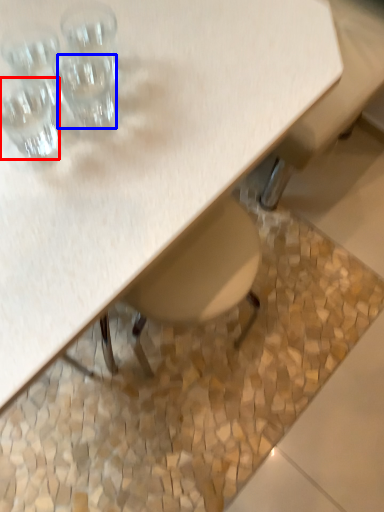
Question: Which object appears closest to the camera in this image, shot glass (highlighted by a red box) or shot glass (highlighted by a blue box)?

Choices:
 (A) shot glass
 (B) shot glass

Answer: (A)